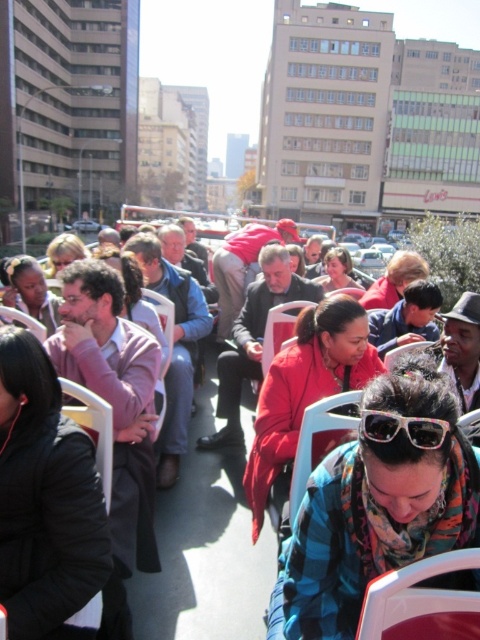
Question: Can you confirm if matte black jacket at center is thinner than black plastic sunglasses at center?

Choices:
 (A) no
 (B) yes

Answer: (A)

Question: Which point is farther to the camera?

Choices:
 (A) matte black jacket at center
 (B) black plastic sunglasses at center

Answer: (A)

Question: Which object appears closest to the camera in this image?

Choices:
 (A) black plastic sunglasses at center
 (B) matte black jacket at center

Answer: (A)

Question: Is matte black jacket at center positioned at the back of black plastic sunglasses at center?

Choices:
 (A) no
 (B) yes

Answer: (B)

Question: Is matte black jacket at center further to camera compared to black plastic sunglasses at center?

Choices:
 (A) no
 (B) yes

Answer: (B)